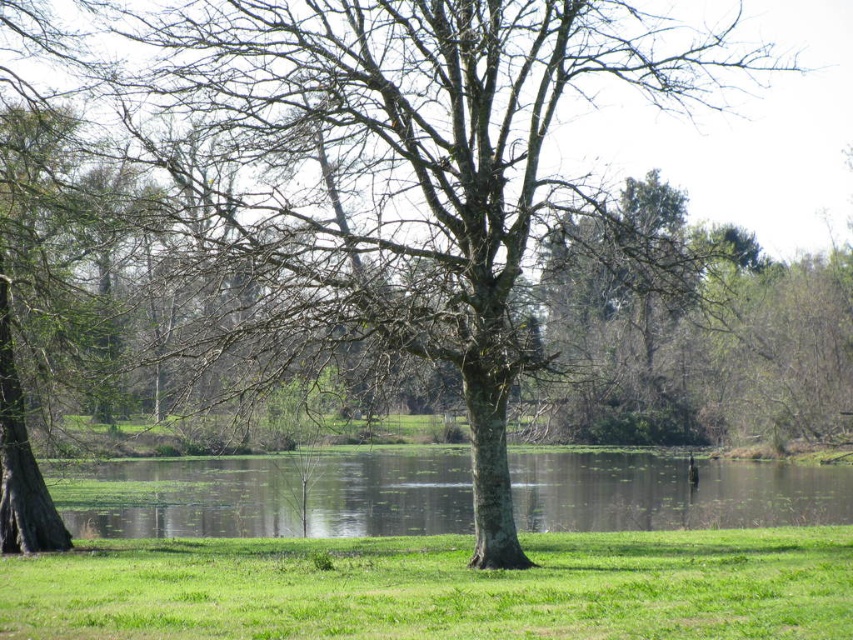
You are a gardener who wants to mow the green grassy at center. However, there is a green reflective water at center nearby. Which area should you avoid mowing to prevent damaging the reflective surface?

You should avoid mowing the green reflective water at center because it is taller than the green grassy at center, indicating it is a water surface and not grass.

Based on the photo, you are standing in the middle of the scene and want to step onto the green reflective water at center. Is the green grassy at center large enough to stand on before reaching the water?

The green grassy at center is smaller than the green reflective water at center, so the grassy area may not be large enough to stand on before reaching the water.